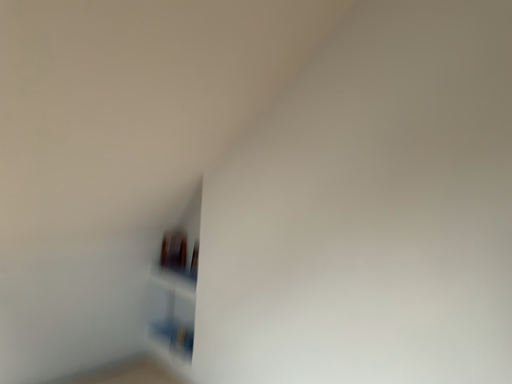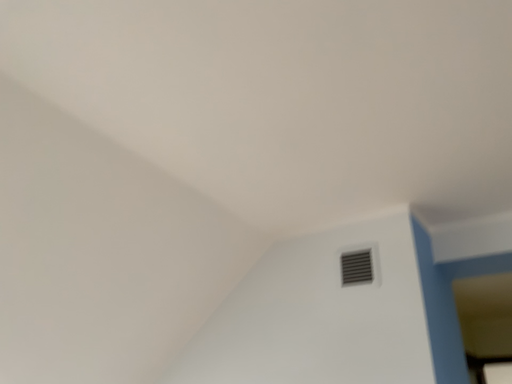
Question: How did the camera likely rotate when shooting the video?

Choices:
 (A) rotated downward
 (B) rotated upward

Answer: (B)